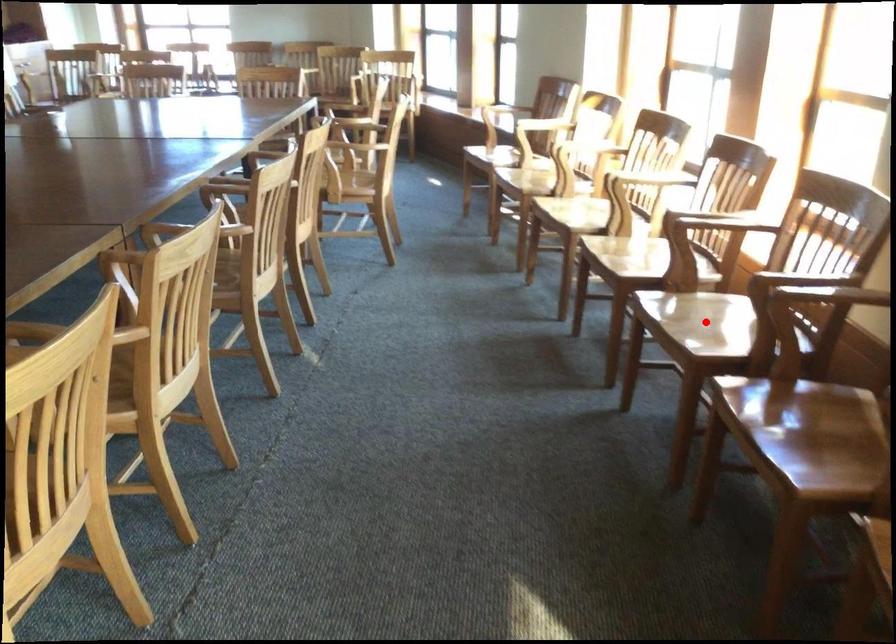
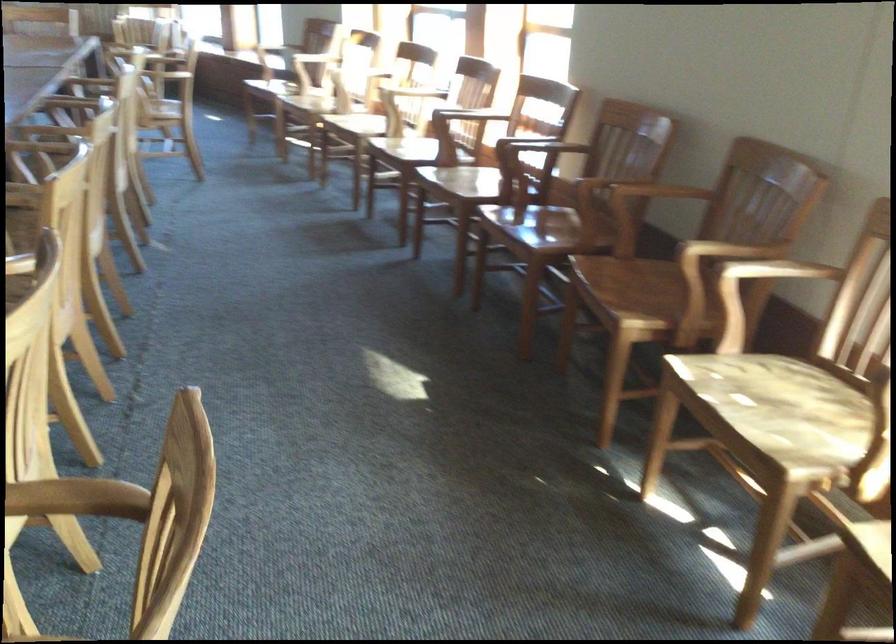
Question: I am providing you with two images of the same scene from different viewpoints. In image1, a red point is highlighted. Considering the same 3D point in image2, which of the following is correct?

Choices:
 (A) It is closer
 (B) It is farther

Answer: (B)